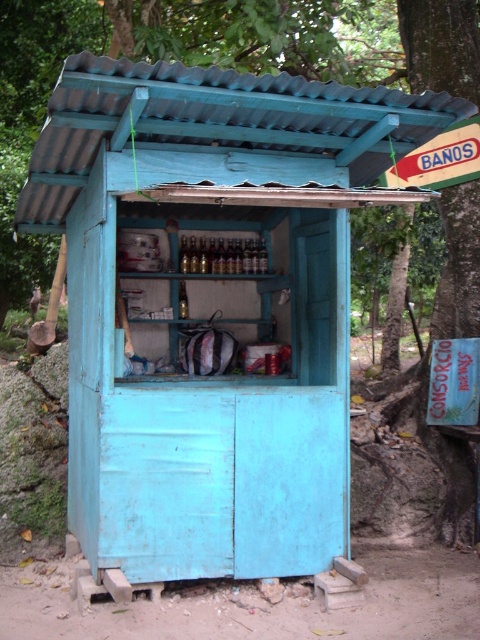
You are standing in front of the rustic blue kiosk and notice two points marked on its walls. The first point is at coordinates point [204,243] and the second is at point [184,289]. From your perspective, which point is closer to you?

Point [204,243] is in front of point [184,289], so it is closer to you.

You are a customer at the rustic blue kiosk and want to grab both the translucent glass bottles at center and the translucent glass bottle at center. Can you reach both items at the same time with your two hands?

The distance between the translucent glass bottles at center and the translucent glass bottle at center is 10.13 inches, which is a short distance. If your hands can comfortably span that distance, you should be able to reach both items simultaneously.